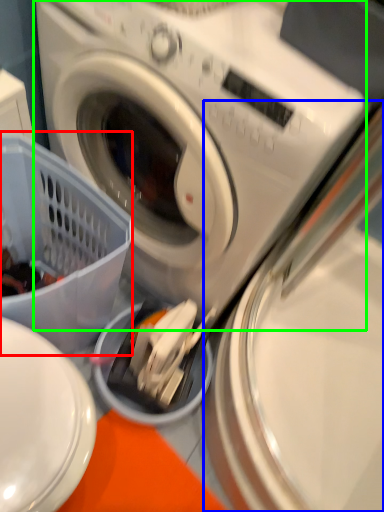
Question: Which is nearer to the basket (highlighted by a red box)? washing machine (highlighted by a blue box) or washing machine (highlighted by a green box).

Choices:
 (A) washing machine
 (B) washing machine

Answer: (B)